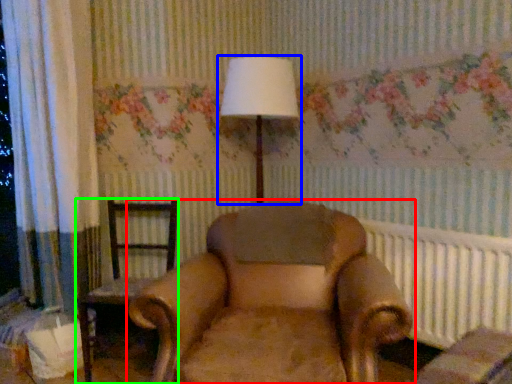
Question: Based on their relative distances, which object is nearer to chair (highlighted by a red box)? Choose from lamp (highlighted by a blue box) and chair (highlighted by a green box).

Choices:
 (A) lamp
 (B) chair

Answer: (B)